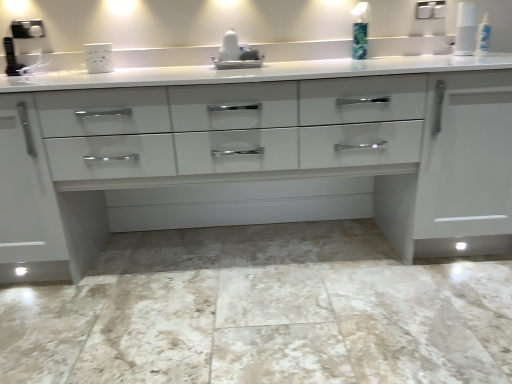
What do you see at coordinates (265, 152) in the screenshot? I see `white glossy chest of drawers at center` at bounding box center [265, 152].

Find the location of a particular element. Image resolution: width=512 pixels, height=384 pixels. white glossy chest of drawers at center is located at coordinates (265, 152).

Describe the element at coordinates (360, 31) in the screenshot. I see `green plastic soap dispenser at upper right` at that location.

Where is `white matte mug at upper center`? white matte mug at upper center is located at coordinates (99, 57).

Considering the sizes of objects marble tile floor at center and white glossy sink at center in the image provided, who is wider, marble tile floor at center or white glossy sink at center?

marble tile floor at center.

Between point (353, 338) and point (245, 66), which one is positioned in front?

The point (353, 338) is more forward.

Could you tell me if marble tile floor at center is turned towards white glossy sink at center?

No, marble tile floor at center is not facing towards white glossy sink at center.

Is marble tile floor at center shorter than white glossy sink at center?

Correct, marble tile floor at center is not as tall as white glossy sink at center.

In the scene shown: Who is taller, white matte mug at upper center or green plastic soap dispenser at upper right?

Standing taller between the two is green plastic soap dispenser at upper right.

Is white matte mug at upper center situated inside green plastic soap dispenser at upper right or outside?

white matte mug at upper center is located beyond the bounds of green plastic soap dispenser at upper right.

Based on the photo, can you confirm if white matte mug at upper center is thinner than green plastic soap dispenser at upper right?

No, white matte mug at upper center is not thinner than green plastic soap dispenser at upper right.

Which object is positioned more to the right, white matte mug at upper center or green plastic soap dispenser at upper right?

From the viewer's perspective, green plastic soap dispenser at upper right appears more on the right side.

From the image's perspective, between white glossy sink at center and marble tile floor at center, who is located below?

marble tile floor at center.

Can you confirm if white glossy sink at center is taller than marble tile floor at center?

Correct, white glossy sink at center is much taller as marble tile floor at center.

From a real-world perspective, between white glossy sink at center and marble tile floor at center, who is vertically lower?

In real-world perspective, marble tile floor at center is lower.

Do you think white glossy sink at center is within marble tile floor at center, or outside of it?

white glossy sink at center is spatially situated outside marble tile floor at center.

Between white glossy sink at center and white glossy chest of drawers at center, which one appears on the right side from the viewer's perspective?

white glossy chest of drawers at center is more to the right.

From the image's perspective, between white glossy sink at center and white glossy chest of drawers at center, who is located below?

white glossy chest of drawers at center is shown below in the image.

Can you tell me how much white glossy sink at center and white glossy chest of drawers at center differ in facing direction?

0.635 degrees separate the facing orientations of white glossy sink at center and white glossy chest of drawers at center.

Which of these two, white glossy sink at center or white glossy chest of drawers at center, is bigger?

With larger size is white glossy chest of drawers at center.

Is marble tile floor at center smaller than green plastic soap dispenser at upper right?

Actually, marble tile floor at center might be larger than green plastic soap dispenser at upper right.

Locate an element on the screen. The image size is (512, 384). soap dispenser above the marble tile floor at center (from a real-world perspective) is located at coordinates (360, 31).

Looking at their sizes, would you say marble tile floor at center is wider or thinner than green plastic soap dispenser at upper right?

marble tile floor at center is wider than green plastic soap dispenser at upper right.

Does white matte mug at upper center turn towards white glossy chest of drawers at center?

Yes, white matte mug at upper center is aimed at white glossy chest of drawers at center.

Looking at this image, is white matte mug at upper center touching white glossy chest of drawers at center?

No.

Is white glossy chest of drawers at center surrounded by white matte mug at upper center?

Actually, white glossy chest of drawers at center is outside white matte mug at upper center.

From the image's perspective, does white matte mug at upper center appear lower than white glossy chest of drawers at center?

Incorrect, from the image's perspective, white matte mug at upper center is higher than white glossy chest of drawers at center.

Considering the points (402, 176) and (361, 14), which point is behind, point (402, 176) or point (361, 14)?

Point (361, 14)

From the image's perspective, relative to green plastic soap dispenser at upper right, is white glossy chest of drawers at center above or below?

Clearly, from the image's perspective, white glossy chest of drawers at center is below green plastic soap dispenser at upper right.

Who is taller, white glossy chest of drawers at center or green plastic soap dispenser at upper right?

Standing taller between the two is white glossy chest of drawers at center.

Find the location of a particular element. soap dispenser behind the white glossy chest of drawers at center is located at coordinates (360, 31).

At what (x,y) coordinates should I click in order to perform the action: click on granite below the white glossy sink at center (from a real-world perspective). Please return your answer as a coordinate pair (x, y). This screenshot has height=384, width=512. Looking at the image, I should click on click(265, 325).

Locate an element on the screen. The height and width of the screenshot is (384, 512). soap dispenser on the right of the white matte mug at upper center is located at coordinates (360, 31).

Which object lies further to the anchor point white matte mug at upper center, white glossy chest of drawers at center or white glossy sink at center?

white glossy chest of drawers at center lies further to white matte mug at upper center than the other object.

When comparing their distances from green plastic soap dispenser at upper right, does white glossy sink at center or white glossy chest of drawers at center seem further?

Among the two, white glossy chest of drawers at center is located further to green plastic soap dispenser at upper right.

Based on their spatial positions, is green plastic soap dispenser at upper right or white matte mug at upper center closer to white glossy chest of drawers at center?

The object closer to white glossy chest of drawers at center is green plastic soap dispenser at upper right.

Consider the image. Looking at the image, which one is located further to white glossy sink at center, marble tile floor at center or white matte mug at upper center?

Based on the image, marble tile floor at center appears to be further to white glossy sink at center.

Which object lies further to the anchor point white matte mug at upper center, white glossy sink at center or white glossy chest of drawers at center?

white glossy chest of drawers at center.

Considering their positions, is green plastic soap dispenser at upper right positioned closer to white glossy sink at center than marble tile floor at center?

green plastic soap dispenser at upper right lies closer to white glossy sink at center than the other object.

From the image, which object appears to be nearer to white glossy sink at center, white matte mug at upper center or marble tile floor at center?

white matte mug at upper center is positioned closer to the anchor white glossy sink at center.

Considering their positions, is white glossy sink at center positioned closer to white glossy chest of drawers at center than green plastic soap dispenser at upper right?

white glossy sink at center.

You are a GUI agent. You are given a task and a screenshot of the screen. Output one action in this format:
    pyautogui.click(x=<x>, y=<y>)
    Task: Click on the sink between white matte mug at upper center and white glossy chest of drawers at center
    The height and width of the screenshot is (384, 512).
    Given the screenshot: What is the action you would take?
    pyautogui.click(x=236, y=54)

Locate an element on the screen. This screenshot has height=384, width=512. appliance between green plastic soap dispenser at upper right and marble tile floor at center vertically is located at coordinates (99, 57).

Where is `sink between green plastic soap dispenser at upper right and marble tile floor at center in the vertical direction`? This screenshot has height=384, width=512. sink between green plastic soap dispenser at upper right and marble tile floor at center in the vertical direction is located at coordinates (236, 54).

Locate an element on the screen. This screenshot has height=384, width=512. chest of drawers between green plastic soap dispenser at upper right and marble tile floor at center from top to bottom is located at coordinates (265, 152).